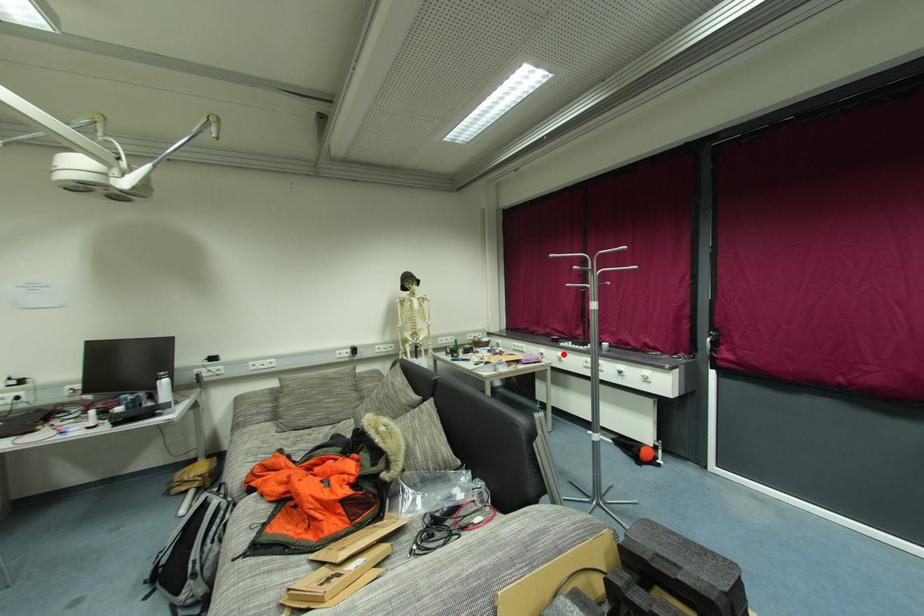
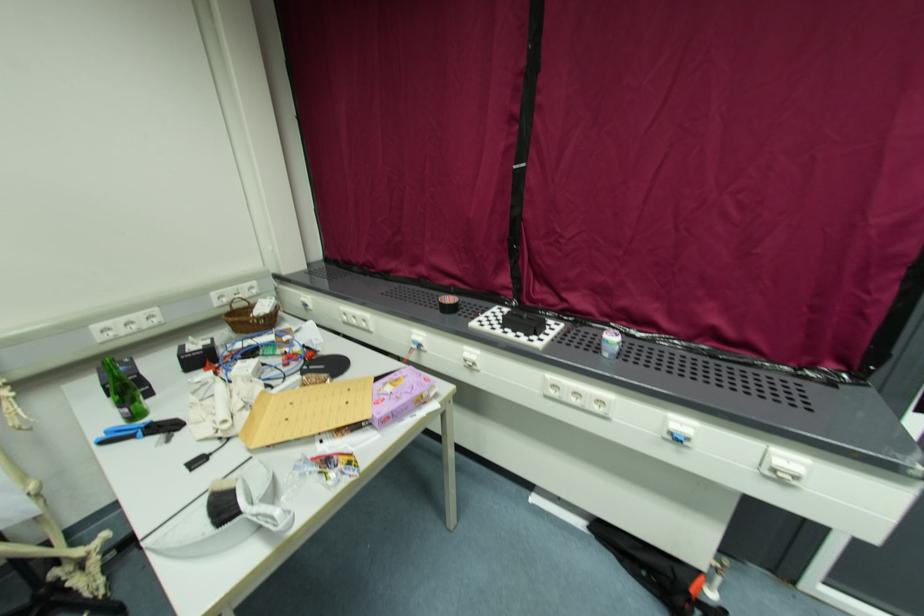
In the second image, find the point that corresponds to the highlighted location in the first image.

(476, 352)